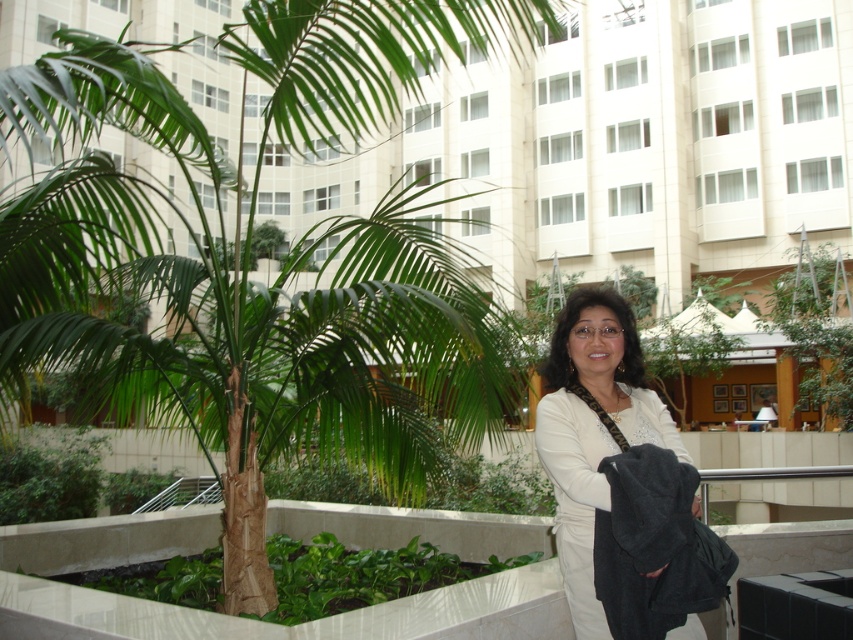
Where is `green leafy palm tree at center`? green leafy palm tree at center is located at coordinates (228, 304).

Does point (97, 106) come in front of point (584, 628)?

No, it is not.

The height and width of the screenshot is (640, 853). Describe the element at coordinates (228, 304) in the screenshot. I see `green leafy palm tree at center` at that location.

What are the coordinates of `green leafy palm tree at center` in the screenshot? It's located at (228, 304).